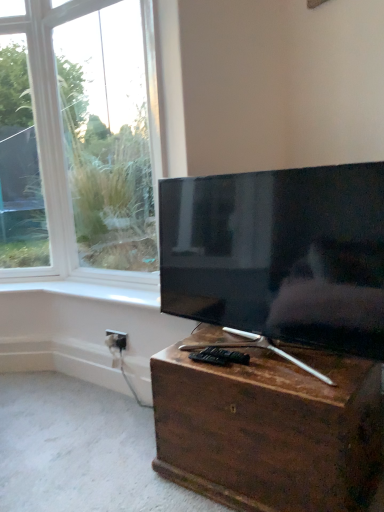
Question: Is white glossy window sill at upper center at the left side of matte black tv at center?

Choices:
 (A) no
 (B) yes

Answer: (B)

Question: Considering the relative sizes of white glossy window sill at upper center and matte black tv at center in the image provided, is white glossy window sill at upper center shorter than matte black tv at center?

Choices:
 (A) yes
 (B) no

Answer: (A)

Question: Considering the relative sizes of white glossy window sill at upper center and matte black tv at center in the image provided, is white glossy window sill at upper center bigger than matte black tv at center?

Choices:
 (A) yes
 (B) no

Answer: (B)

Question: Considering the relative positions of white glossy window sill at upper center and matte black tv at center in the image provided, is white glossy window sill at upper center to the right of matte black tv at center from the viewer's perspective?

Choices:
 (A) no
 (B) yes

Answer: (A)

Question: Is white glossy window sill at upper center oriented away from matte black tv at center?

Choices:
 (A) yes
 (B) no

Answer: (B)

Question: Considering the relative positions of white glossy window sill at upper center and matte black tv at center in the image provided, is white glossy window sill at upper center behind matte black tv at center?

Choices:
 (A) no
 (B) yes

Answer: (B)

Question: Can you confirm if white plastic electric outlet at lower center is thinner than matte black tv at center?

Choices:
 (A) yes
 (B) no

Answer: (A)

Question: From a real-world perspective, is white plastic electric outlet at lower center positioned under matte black tv at center based on gravity?

Choices:
 (A) yes
 (B) no

Answer: (A)

Question: Considering the relative sizes of white plastic electric outlet at lower center and matte black tv at center in the image provided, is white plastic electric outlet at lower center bigger than matte black tv at center?

Choices:
 (A) yes
 (B) no

Answer: (B)

Question: From the image's perspective, is white plastic electric outlet at lower center above matte black tv at center?

Choices:
 (A) no
 (B) yes

Answer: (A)

Question: Considering the relative sizes of white plastic electric outlet at lower center and matte black tv at center in the image provided, is white plastic electric outlet at lower center taller than matte black tv at center?

Choices:
 (A) yes
 (B) no

Answer: (B)

Question: Is white plastic electric outlet at lower center far away from matte black tv at center?

Choices:
 (A) yes
 (B) no

Answer: (B)

Question: Does white glossy window sill at upper center touch white plastic electric outlet at lower center?

Choices:
 (A) no
 (B) yes

Answer: (A)